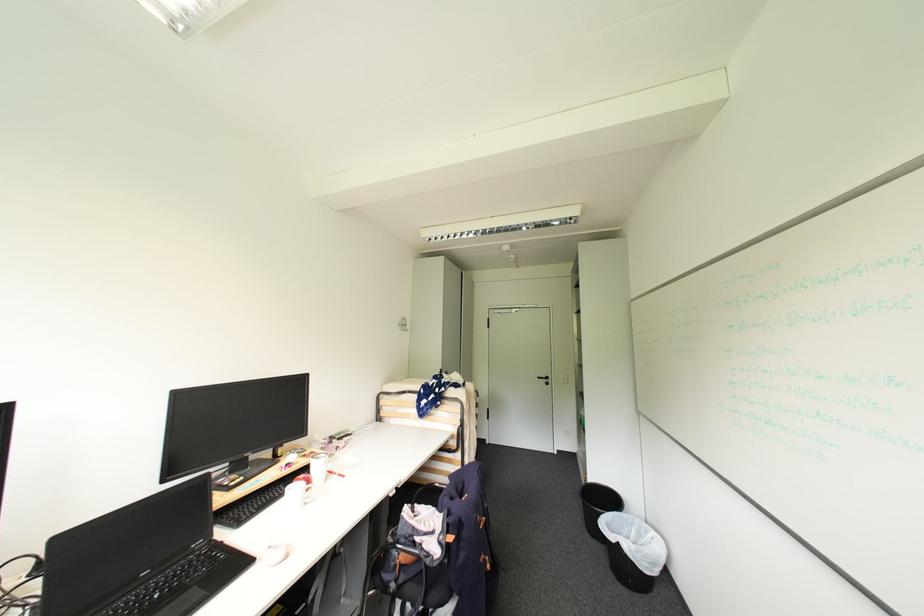
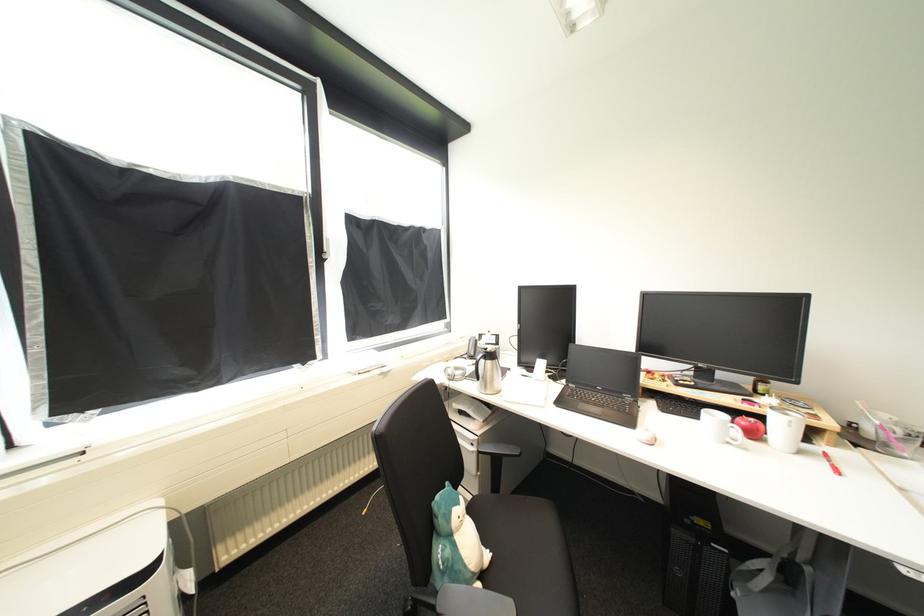
Locate, in the second image, the point that corresponds to point 343,477 in the first image.

(834, 464)